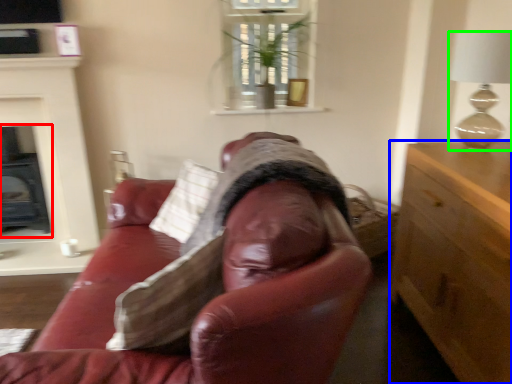
Question: Which is nearer to the fireplace (highlighted by a red box)? cabinetry (highlighted by a blue box) or lamp (highlighted by a green box).

Choices:
 (A) cabinetry
 (B) lamp

Answer: (A)